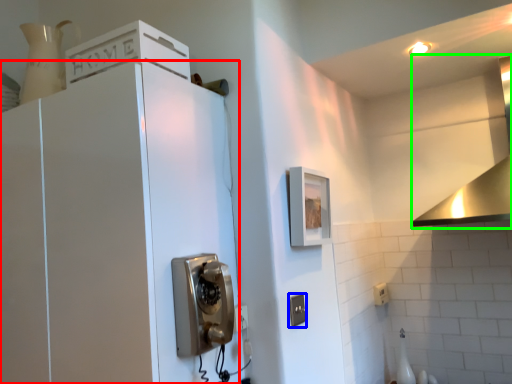
Question: Which object is the closest to the cabinetry (highlighted by a red box)? Choose among these: electric outlet (highlighted by a blue box) or vent (highlighted by a green box).

Choices:
 (A) electric outlet
 (B) vent

Answer: (A)